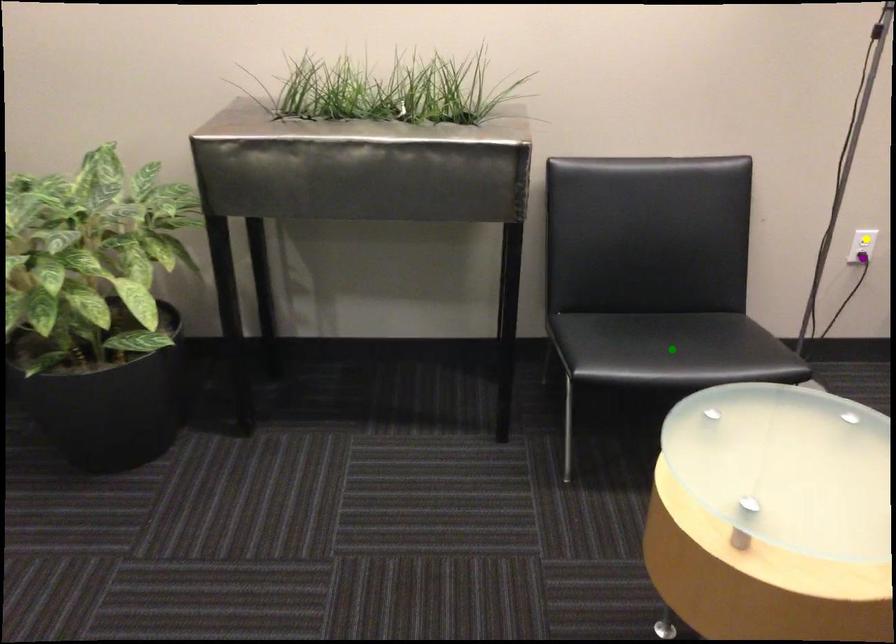
Order these from farthest to nearest:
1. purple point
2. yellow point
3. green point

purple point → yellow point → green point